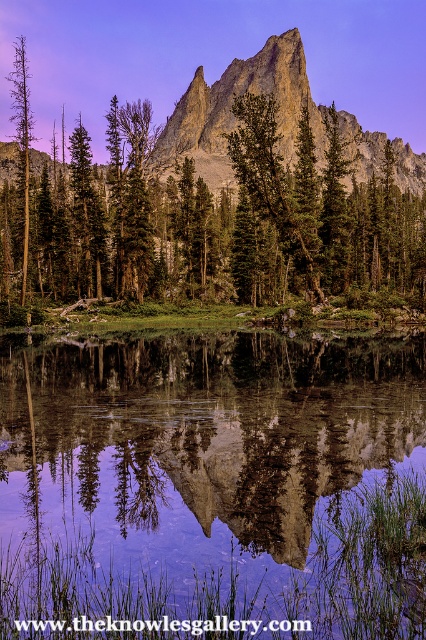
Who is positioned more to the right, clear glass water at center or green matte tree at center?

clear glass water at center

Is clear glass water at center bigger than green matte tree at center?

No, clear glass water at center is not bigger than green matte tree at center.

Is point (370, 493) positioned before point (71, 268)?

That is True.

Image resolution: width=426 pixels, height=640 pixels. I want to click on clear glass water at center, so click(213, 486).

Based on the photo, who is more distant from viewer, (143, 291) or (23, 157)?

The point (143, 291) is more distant.

Between point (69, 260) and point (26, 209), which one is positioned in front?

Positioned in front is point (26, 209).

Between point (55, 232) and point (28, 152), which one is positioned in front?

Point (55, 232)

The width and height of the screenshot is (426, 640). Identify the location of green matte tree at center. (210, 224).

Which is more to the left, green matte tree at center or rugged granite peak at center?

Positioned to the left is green matte tree at center.

Who is taller, green matte tree at center or rugged granite peak at center?

green matte tree at center

Where is `green matte tree at center`? The image size is (426, 640). green matte tree at center is located at coordinates (210, 224).